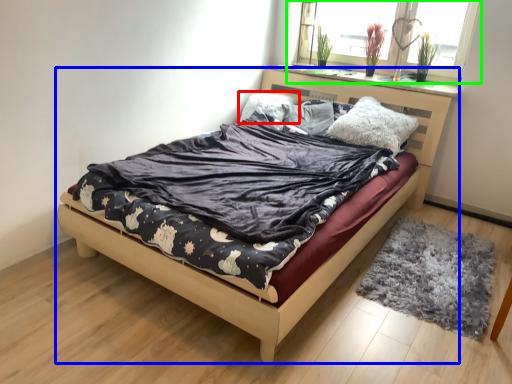
Question: Which is nearer to the pillow (highlighted by a red box)? bed (highlighted by a blue box) or window (highlighted by a green box).

Choices:
 (A) bed
 (B) window

Answer: (B)